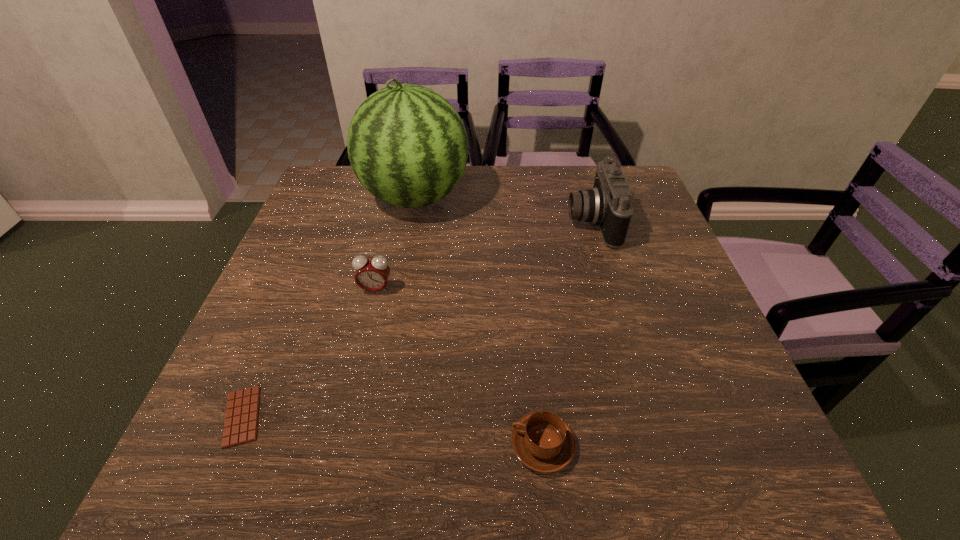
This screenshot has width=960, height=540. I want to click on watermelon, so click(407, 145).

Identify the location of the rightmost object. The image size is (960, 540). (608, 205).

Where is `camera`? The image size is (960, 540). camera is located at coordinates (608, 205).

You are a GUI agent. You are given a task and a screenshot of the screen. Output one action in this format:
    pyautogui.click(x=<x>, y=<y>)
    Task: Click on the third shortest object
    The image size is (960, 540).
    Given the screenshot: What is the action you would take?
    pyautogui.click(x=372, y=274)

In order to click on alarm clock in this screenshot , I will do `click(372, 274)`.

You are a GUI agent. You are given a task and a screenshot of the screen. Output one action in this format:
    pyautogui.click(x=<x>, y=<y>)
    Task: Click on the fourth object from left to right
    The width and height of the screenshot is (960, 540).
    Given the screenshot: What is the action you would take?
    pyautogui.click(x=544, y=442)

Where is `cappuccino`? The height and width of the screenshot is (540, 960). cappuccino is located at coordinates (544, 442).

Locate an element on the screen. Image resolution: width=960 pixels, height=540 pixels. the leftmost object is located at coordinates (241, 419).

At what (x,y) coordinates should I click in order to perform the action: click on candy bar. Please return your answer as a coordinate pair (x, y). Looking at the image, I should click on (x=241, y=419).

The width and height of the screenshot is (960, 540). I want to click on vacant region located on the front of the watermelon, so click(401, 271).